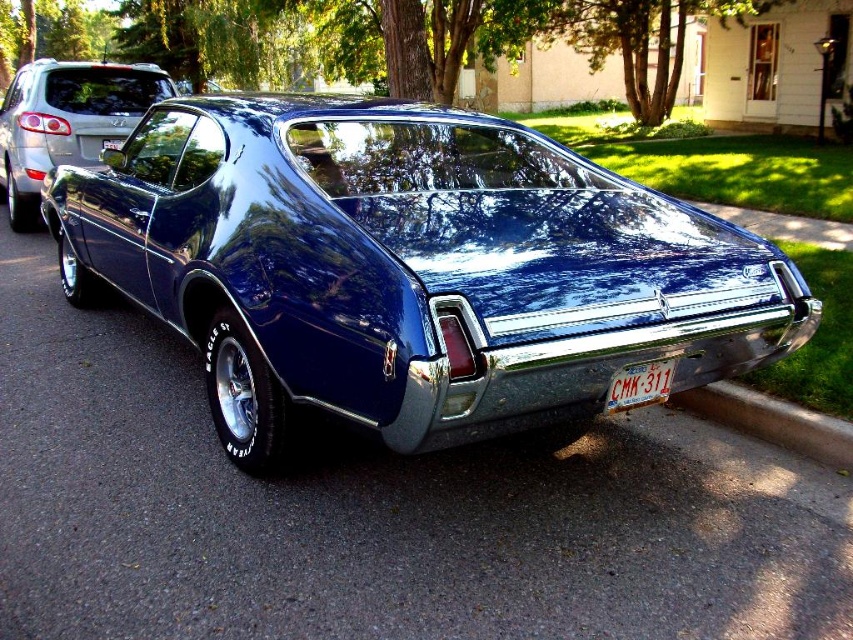
Question: Is glossy blue car at center smaller than glossy blue car at left?

Choices:
 (A) no
 (B) yes

Answer: (A)

Question: Which point appears closest to the camera in this image?

Choices:
 (A) (804, 451)
 (B) (677, 376)

Answer: (B)

Question: Can you confirm if glossy blue car at center is positioned to the left of glossy blue car at left?

Choices:
 (A) yes
 (B) no

Answer: (B)

Question: Which of the following is the closest to the observer?

Choices:
 (A) (645, 365)
 (B) (700, 404)

Answer: (A)

Question: Considering the real-world distances, which object is farthest from the glossy blue car at left?

Choices:
 (A) gray concrete curb at lower right
 (B) glossy blue car at center

Answer: (A)

Question: Is glossy blue car at left thinner than white plastic license plate at lower center?

Choices:
 (A) yes
 (B) no

Answer: (B)